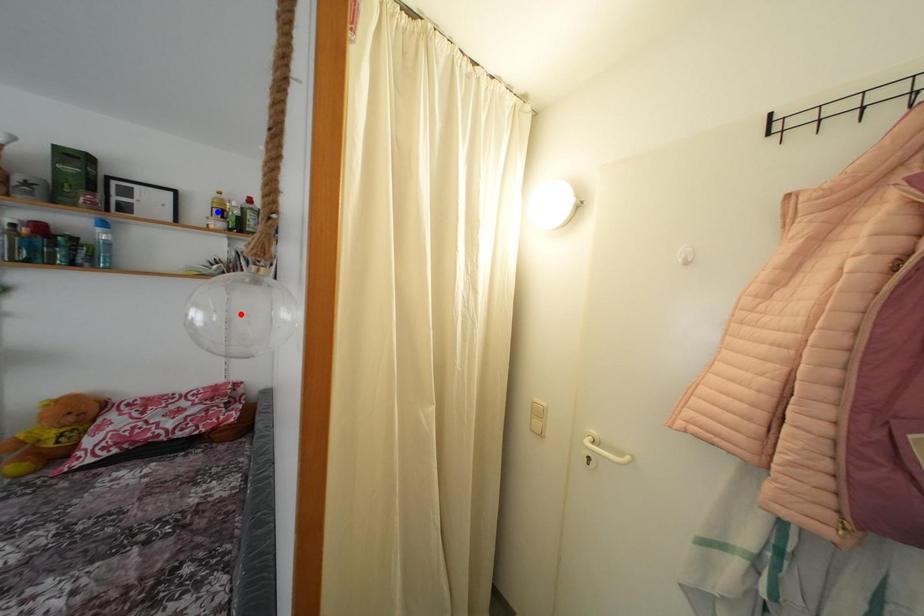
Question: Two points are marked on the image. Which point is closer to the camera?

Choices:
 (A) Blue point is closer.
 (B) Red point is closer.

Answer: (B)